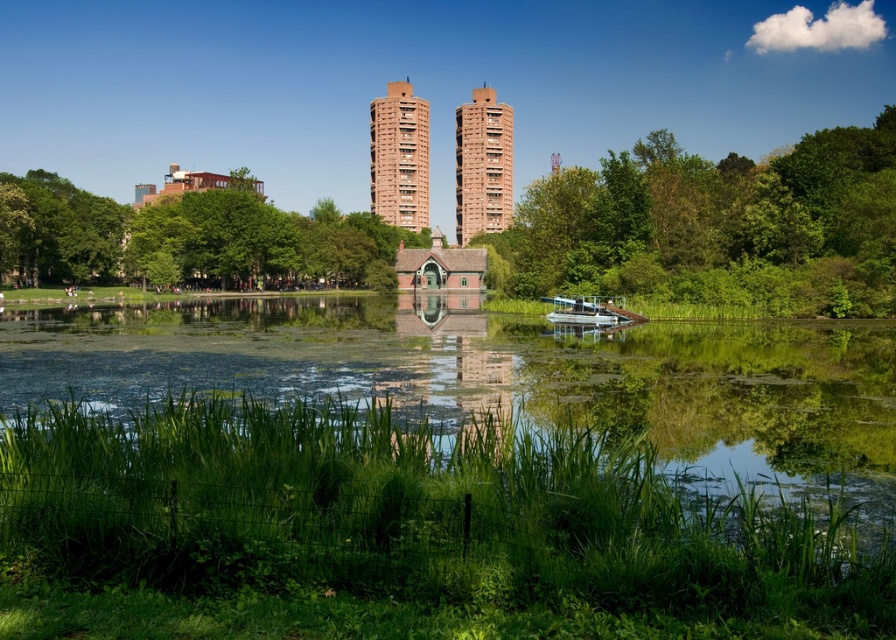
Question: Does green leafy tree at center have a greater width compared to green leafy tree at upper left?

Choices:
 (A) yes
 (B) no

Answer: (B)

Question: Which object appears closest to the camera in this image?

Choices:
 (A) green grassy river at center
 (B) brown brick building at center

Answer: (A)

Question: Can you confirm if green leafy tree at center is thinner than brown brick building at center?

Choices:
 (A) no
 (B) yes

Answer: (A)

Question: Does brown brick building at center appear under metallic silver pontoon boat at center?

Choices:
 (A) no
 (B) yes

Answer: (A)

Question: Which point is farther to the camera?

Choices:
 (A) green grassy river at center
 (B) brown brick building at center
 (C) brown brick building at upper center

Answer: (C)

Question: Among these points, which one is farthest from the camera?

Choices:
 (A) (403, 179)
 (B) (468, 296)

Answer: (A)